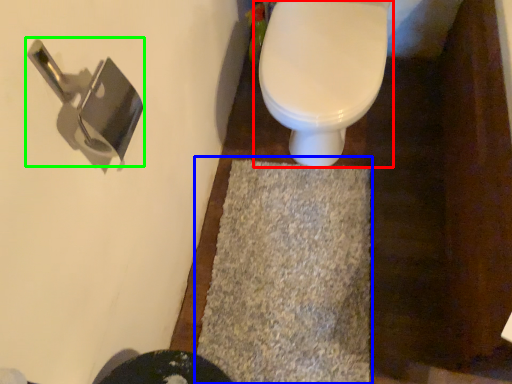
Question: Which object is the farthest from toilet (highlighted by a red box)? Choose among these: bath mat (highlighted by a blue box) or door handle (highlighted by a green box).

Choices:
 (A) bath mat
 (B) door handle

Answer: (B)